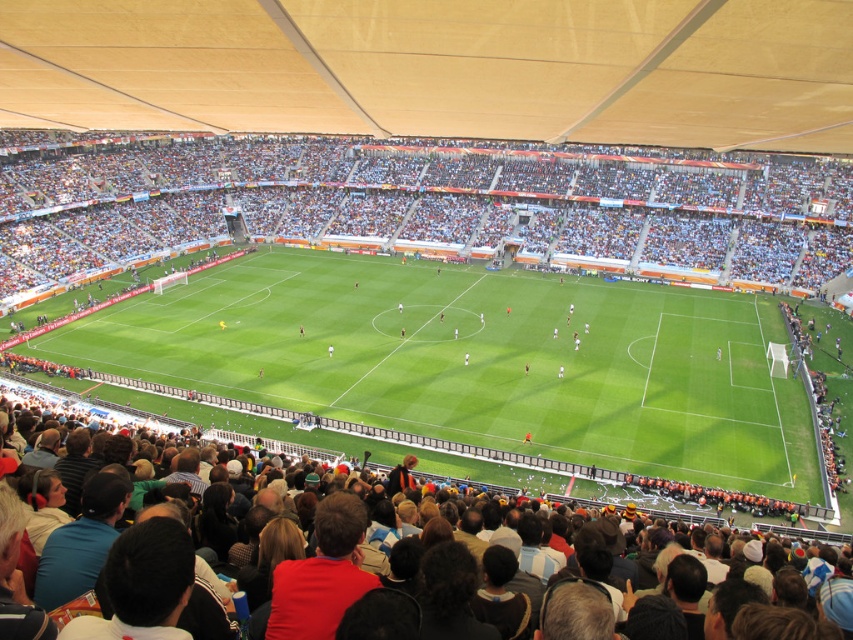
Does green grass football field at center have a greater height compared to dark brown leather jacket at lower center?

Yes, green grass football field at center is taller than dark brown leather jacket at lower center.

Does green grass football field at center appear on the left side of dark brown leather jacket at lower center?

In fact, green grass football field at center is to the right of dark brown leather jacket at lower center.

Is point (202, 307) positioned in front of point (358, 524)?

No, (202, 307) is further to viewer.

The height and width of the screenshot is (640, 853). Find the location of `green grass football field at center`. green grass football field at center is located at coordinates (479, 362).

Is point (618, 134) farther from viewer compared to point (787, 625)?

Yes, it is behind point (787, 625).

I want to click on matte beige canopy at upper center, so click(439, 68).

Is point (218, 307) positioned behind point (666, 124)?

Yes, it is.

Is point (199, 288) positioned in front of point (850, 60)?

No, (199, 288) is behind (850, 60).

Identify the location of green grass football field at center. The width and height of the screenshot is (853, 640). (479, 362).